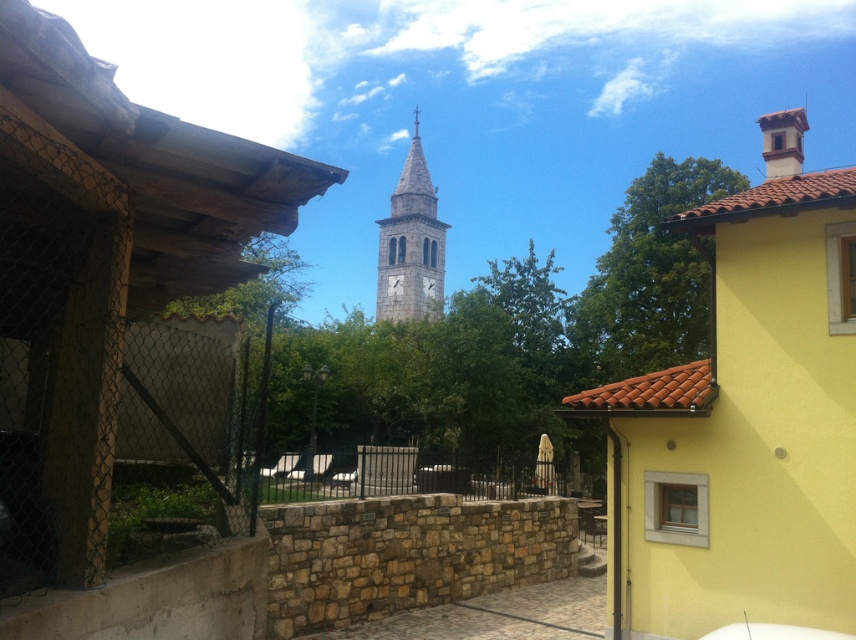
Is stone clock tower at center smaller than gray stone clock tower at center?

Indeed, stone clock tower at center has a smaller size compared to gray stone clock tower at center.

Does stone clock tower at center have a lesser height compared to gray stone clock tower at center?

Indeed, stone clock tower at center has a lesser height compared to gray stone clock tower at center.

In order to click on stone clock tower at center in this screenshot , I will do `click(122, 348)`.

Is stone clock tower at center positioned behind yellow matte building at upper right?

No.

Does stone clock tower at center have a smaller size compared to yellow matte building at upper right?

Yes, stone clock tower at center is smaller than yellow matte building at upper right.

Is point (78, 186) positioned before point (803, 392)?

That is True.

This screenshot has height=640, width=856. What are the coordinates of `stone clock tower at center` in the screenshot? It's located at (122, 348).

Can you confirm if stone clock tower at center is positioned above black metal fence at center?

Yes, stone clock tower at center is above black metal fence at center.

Who is lower down, stone clock tower at center or black metal fence at center?

black metal fence at center is lower down.

Where is `stone clock tower at center`? The image size is (856, 640). stone clock tower at center is located at coordinates (122, 348).